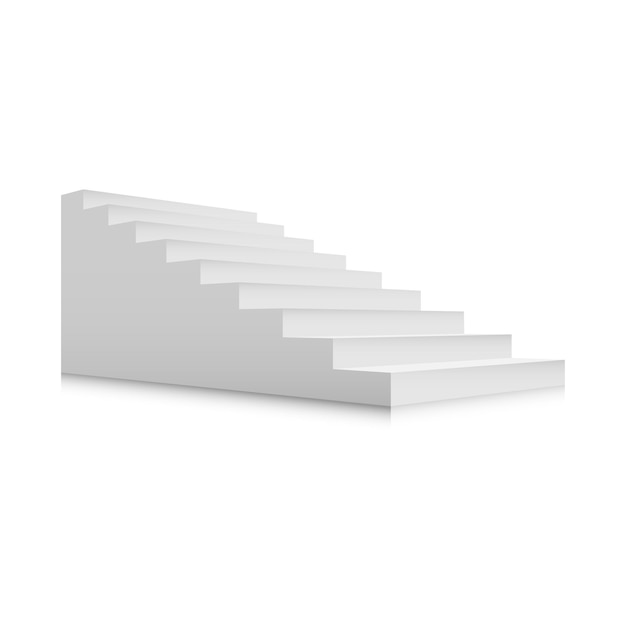
Identify the location of individual stairs. This screenshot has height=626, width=626. (446, 377), (394, 350), (362, 326), (315, 299), (288, 277), (255, 254), (223, 238), (202, 222), (185, 211).